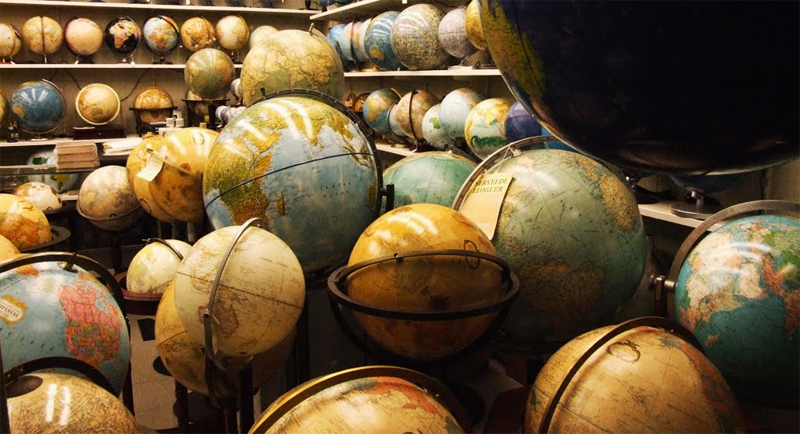
Locate an element on the screen. Image resolution: width=800 pixels, height=434 pixels. wall is located at coordinates (758, 186), (116, 84), (102, 18), (442, 83).